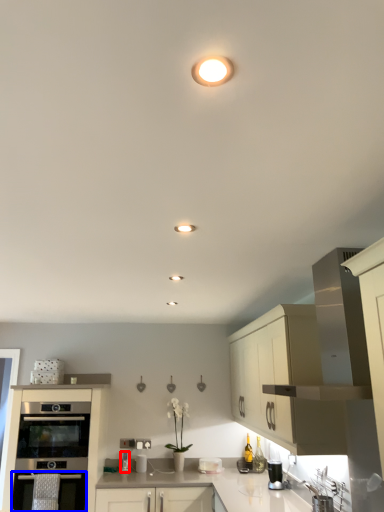
Question: Which of the following is the closest to the observer, appliance (highlighted by a red box) or oven (highlighted by a blue box)?

Choices:
 (A) appliance
 (B) oven

Answer: (B)